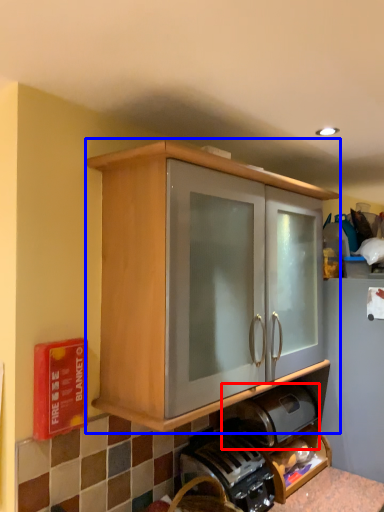
Question: Which object appears closest to the camera in this image, appliance (highlighted by a red box) or cabinetry (highlighted by a blue box)?

Choices:
 (A) appliance
 (B) cabinetry

Answer: (B)